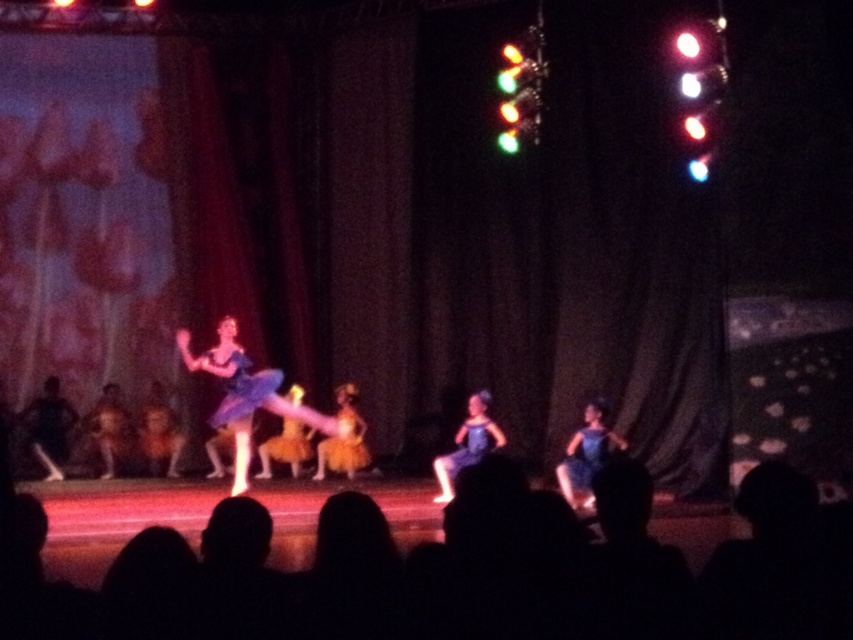
You are a stagehand who needs to place a 2.5 meter long ladder between the matte blue dress at center and the matte black dress at center. Can the ladder fit between them without overlapping either dress?

The distance between the matte blue dress at center and the matte black dress at center is 3.24 meters. Since the ladder is 2.5 meters long, it can fit between them without overlapping either dress as there is enough space.

From the picture: You are a stagehand responsible for adjusting the spotlight. The spotlight can only illuminate objects within a 0.3 unit radius centered at point A. If point A is at coordinates 0.5, 0.5, will the matte blue dress at center be illuminated by the spotlight?

The matte blue dress at center is located at point (247,396). The distance from point A (426,320) to this point is sqrt 0.019 squared plus 0.209 squared, which is approximately 0.21 units. Since this is within the 0.3 unit radius, the dress will be illuminated by the spotlight.